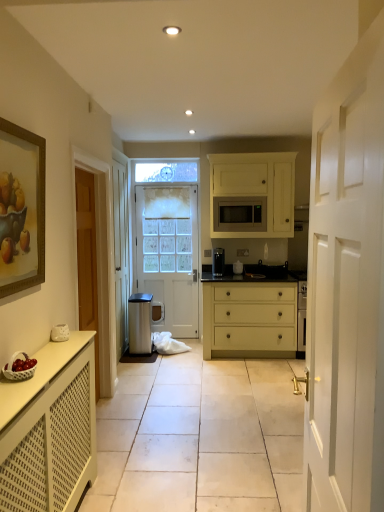
Question: Is white matte drawer at center taller or shorter than white matte cabinet at lower left, which ranks as the 2th cabinetry in top-to-bottom order?

Choices:
 (A) tall
 (B) short

Answer: (A)

Question: Considering the positions of white matte drawer at center and white matte cabinet at lower left, positioned as the second cabinetry in back-to-front order, in the image, is white matte drawer at center bigger or smaller than white matte cabinet at lower left, positioned as the second cabinetry in back-to-front order,?

Choices:
 (A) small
 (B) big

Answer: (B)

Question: Considering the real-world distances, which object is closest to the white wicker basket at lower left?

Choices:
 (A) white textured door at center, the 1th door from the left
 (B) wooden framed painting at left
 (C) white glossy radiator at lower left
 (D) white matte cabinet at center, the 1th cabinetry from the top
 (E) white matte cabinet at lower left, positioned as the second cabinetry in back-to-front order

Answer: (E)

Question: Estimate the real-world distances between objects in this image. Which object is farther from the white wicker basket at lower left?

Choices:
 (A) wooden framed painting at left
 (B) black matte stove at center, the second appliance positioned from the left
 (C) satin black coffee maker at center, arranged as the 1th appliance when viewed from the left
 (D) satin silver microwave at center
 (E) white glossy door at right, which is counted as the second door, starting from the left

Answer: (C)